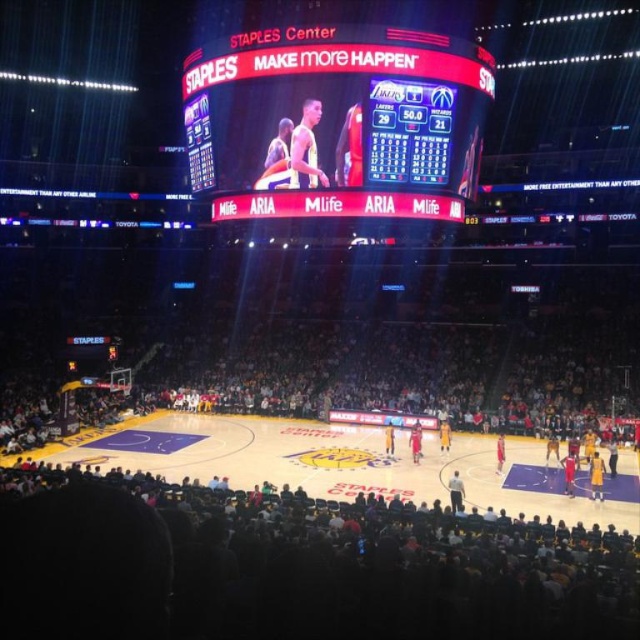
You are a photographer trying to capture a photo of the purple polished wood court at center. You notice the matte digital scoreboard at upper center is blocking your view. Can you determine if the scoreboard is taller than the court, making it harder to frame the shot?

The matte digital scoreboard at upper center is much taller than the purple polished wood court at center, so it will block your view and make it harder to frame the shot.

Based on the photo, you are a spectator at the Staples Center and want to locate the matte digital scoreboard at upper center. Where should you look?

You should look at point (x=339, y=120) to find the matte digital scoreboard at upper center.

You are a spectator at the game and want to see both the matte digital scoreboard at upper center and the purple polished wood court at center. Which object is located higher in the image?

The matte digital scoreboard at upper center is above the purple polished wood court at center, so it is higher in the image.